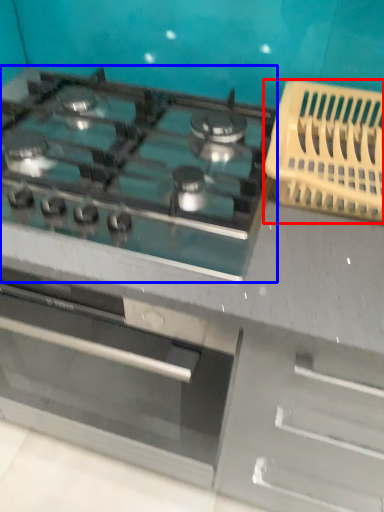
Question: Which of the following is the farthest to the observer, basket (highlighted by a red box) or gas stove (highlighted by a blue box)?

Choices:
 (A) basket
 (B) gas stove

Answer: (A)